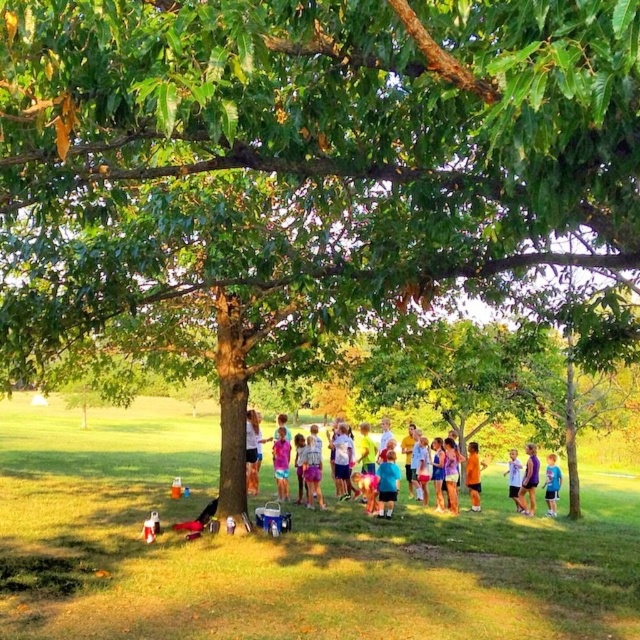
Is multicolored casual clothing at center further to the viewer compared to white cotton shirt at center?

Yes, it is.

Between multicolored casual clothing at center and white cotton shirt at center, which one appears on the right side from the viewer's perspective?

Positioned to the right is multicolored casual clothing at center.

Locate an element on the screen. The width and height of the screenshot is (640, 640). multicolored casual clothing at center is located at coordinates (304, 472).

Does green grass at lower center have a larger size compared to multicolored casual clothing at center?

Correct, green grass at lower center is larger in size than multicolored casual clothing at center.

Locate an element on the screen. Image resolution: width=640 pixels, height=640 pixels. green grass at lower center is located at coordinates (288, 548).

Where is `green grass at lower center`? green grass at lower center is located at coordinates (288, 548).

Does green grass at lower center have a greater width compared to blue cotton shirt at lower right?

Correct, the width of green grass at lower center exceeds that of blue cotton shirt at lower right.

Who is higher up, green grass at lower center or blue cotton shirt at lower right?

Positioned higher is blue cotton shirt at lower right.

This screenshot has width=640, height=640. I want to click on green grass at lower center, so click(x=288, y=548).